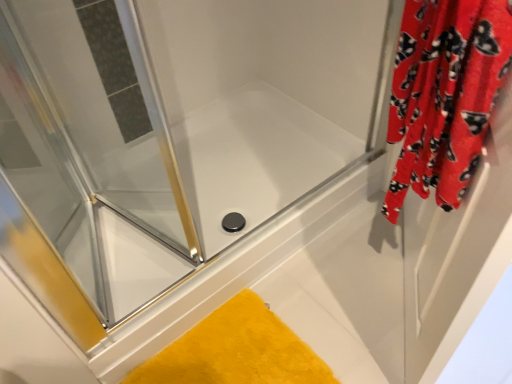
Question: From the image's perspective, is yellow plush bath mat at lower center on top of clear glass shower door at upper left, the 1th screen door in the left-to-right sequence?

Choices:
 (A) no
 (B) yes

Answer: (A)

Question: From a real-world perspective, is yellow plush bath mat at lower center beneath clear glass shower door at upper left, arranged as the second screen door when viewed from the right?

Choices:
 (A) yes
 (B) no

Answer: (A)

Question: Is yellow plush bath mat at lower center to the left of clear glass shower door at upper left, the 1th screen door in the left-to-right sequence, from the viewer's perspective?

Choices:
 (A) no
 (B) yes

Answer: (A)

Question: Would you say yellow plush bath mat at lower center contains clear glass shower door at upper left, arranged as the second screen door when viewed from the right?

Choices:
 (A) yes
 (B) no

Answer: (B)

Question: Does yellow plush bath mat at lower center have a greater width compared to clear glass shower door at upper left, the 1th screen door in the left-to-right sequence?

Choices:
 (A) yes
 (B) no

Answer: (B)

Question: Considering the relative sizes of yellow plush bath mat at lower center and clear glass shower door at upper left, arranged as the second screen door when viewed from the right, in the image provided, is yellow plush bath mat at lower center thinner than clear glass shower door at upper left, arranged as the second screen door when viewed from the right,?

Choices:
 (A) yes
 (B) no

Answer: (A)

Question: Is red velvet curtain at right behind red fabric curtain at right, acting as the first screen door starting from the right?

Choices:
 (A) yes
 (B) no

Answer: (B)

Question: From the image's perspective, would you say red velvet curtain at right is positioned over red fabric curtain at right, the 2th screen door when ordered from left to right?

Choices:
 (A) no
 (B) yes

Answer: (B)

Question: Are red velvet curtain at right and red fabric curtain at right, acting as the first screen door starting from the right, making contact?

Choices:
 (A) no
 (B) yes

Answer: (A)

Question: Considering the relative positions of red velvet curtain at right and red fabric curtain at right, the 2th screen door when ordered from left to right, in the image provided, is red velvet curtain at right to the left of red fabric curtain at right, the 2th screen door when ordered from left to right, from the viewer's perspective?

Choices:
 (A) yes
 (B) no

Answer: (A)

Question: Is red velvet curtain at right not inside red fabric curtain at right, the 2th screen door when ordered from left to right?

Choices:
 (A) no
 (B) yes

Answer: (B)

Question: Is red velvet curtain at right taller than red fabric curtain at right, the 2th screen door when ordered from left to right?

Choices:
 (A) no
 (B) yes

Answer: (A)

Question: Could you tell me if clear glass shower door at upper left, arranged as the second screen door when viewed from the right, is turned towards yellow plush bath mat at lower center?

Choices:
 (A) no
 (B) yes

Answer: (A)